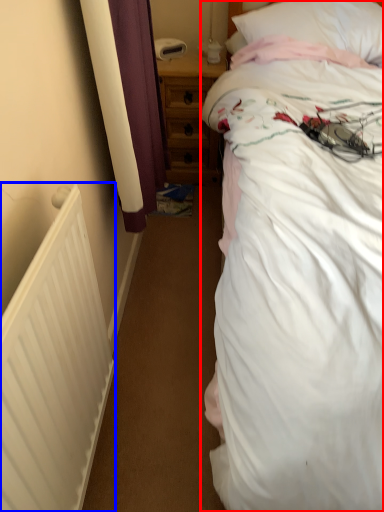
Question: Among these objects, which one is nearest to the camera, bed (highlighted by a red box) or radiator (highlighted by a blue box)?

Choices:
 (A) bed
 (B) radiator

Answer: (A)